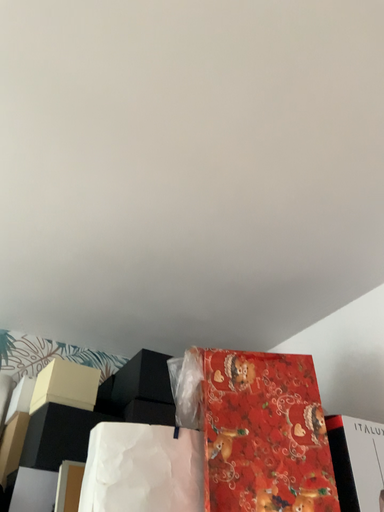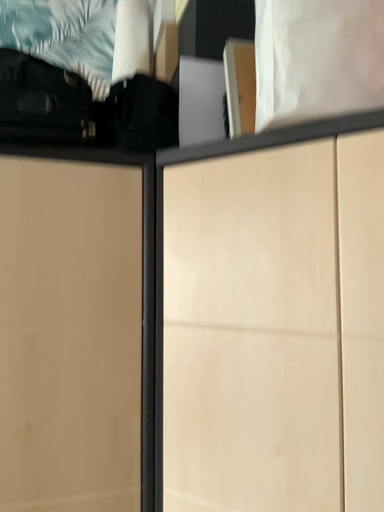
Question: Which way did the camera rotate in the video?

Choices:
 (A) rotated downward
 (B) rotated upward

Answer: (A)